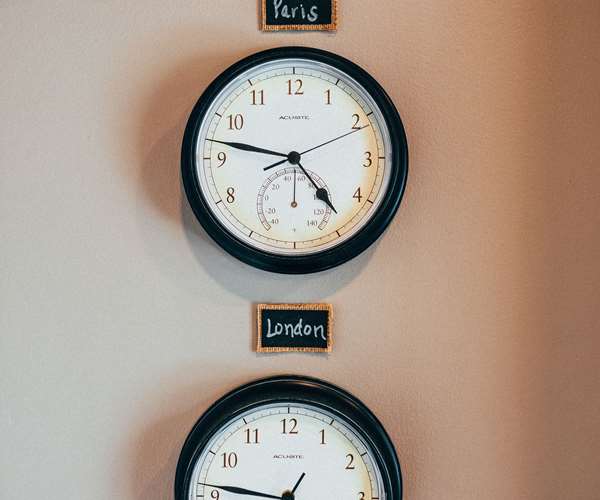
Locate an element on the screen. The image size is (600, 500). thermometer is located at coordinates (293, 204).